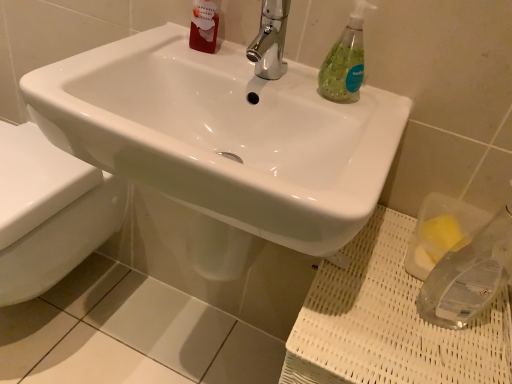
Image resolution: width=512 pixels, height=384 pixels. Identify the location of blank area to the left of green translucent soap dispenser at upper right. (271, 77).